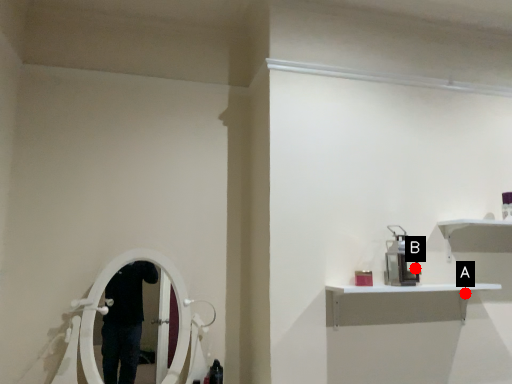
Question: Two points are circled on the image, labeled by A and B beside each circle. Which point is closer to the camera?

Choices:
 (A) A is closer
 (B) B is closer

Answer: (B)